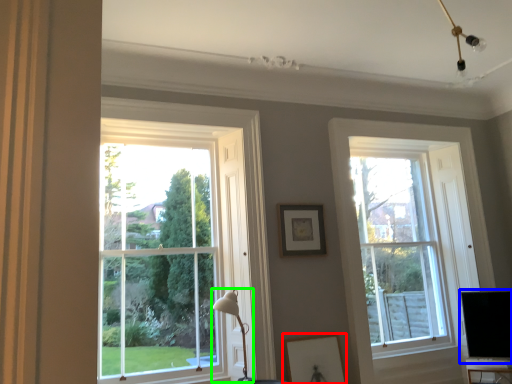
Question: Estimate the real-world distances between objects in this image. Which object is farther from picture frame (highlighted by a red box), computer monitor (highlighted by a blue box) or table lamp (highlighted by a green box)?

Choices:
 (A) computer monitor
 (B) table lamp

Answer: (A)